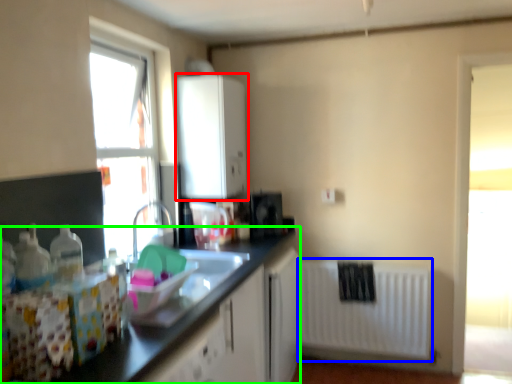
Question: Based on their relative distances, which object is nearer to cabinetry (highlighted by a red box)? Choose from radiator (highlighted by a blue box) and countertop (highlighted by a green box).

Choices:
 (A) radiator
 (B) countertop

Answer: (B)